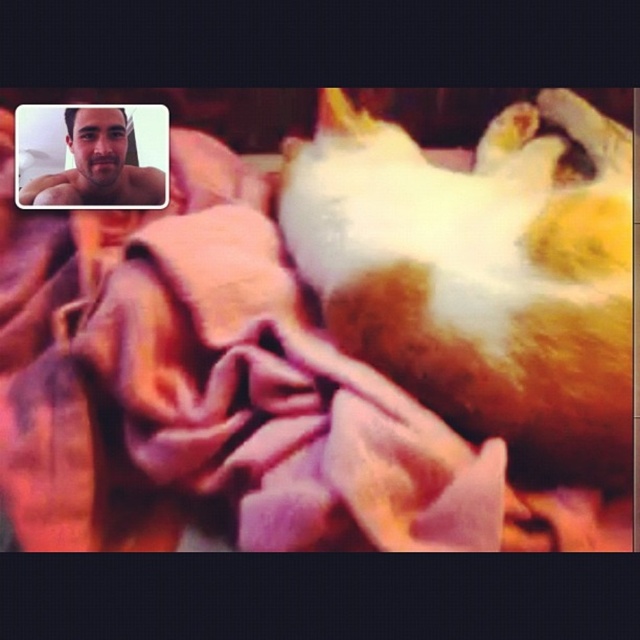
Question: Is fluffy orange cat at center thinner than matte skin at upper left?

Choices:
 (A) yes
 (B) no

Answer: (B)

Question: Which point appears closest to the camera in this image?

Choices:
 (A) (20, 170)
 (B) (600, 179)

Answer: (B)

Question: Which object is closer to the camera taking this photo?

Choices:
 (A) fluffy orange cat at center
 (B) matte skin at upper left

Answer: (A)

Question: Is the position of fluffy orange cat at center less distant than that of matte skin at upper left?

Choices:
 (A) no
 (B) yes

Answer: (B)

Question: From the image, what is the correct spatial relationship of fluffy orange cat at center in relation to matte skin at upper left?

Choices:
 (A) left
 (B) right

Answer: (B)